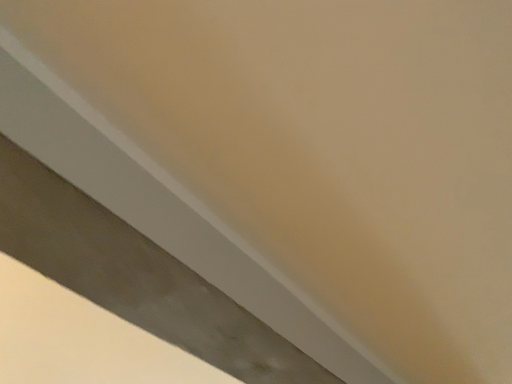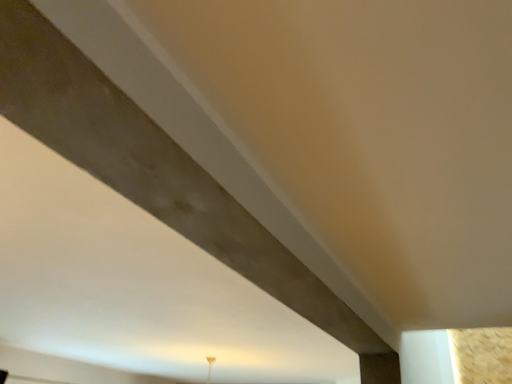
Question: Which way did the camera rotate in the video?

Choices:
 (A) rotated upward
 (B) rotated downward

Answer: (B)